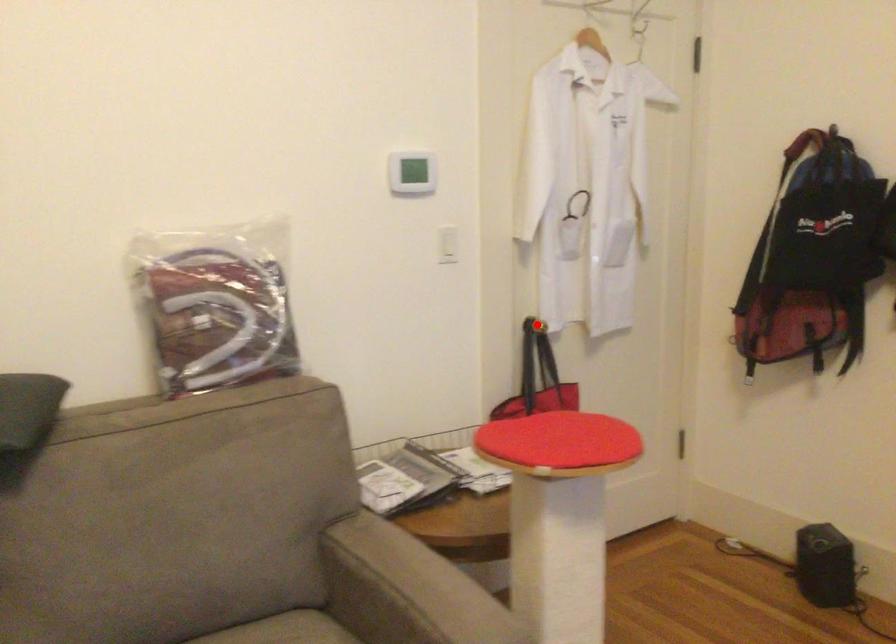
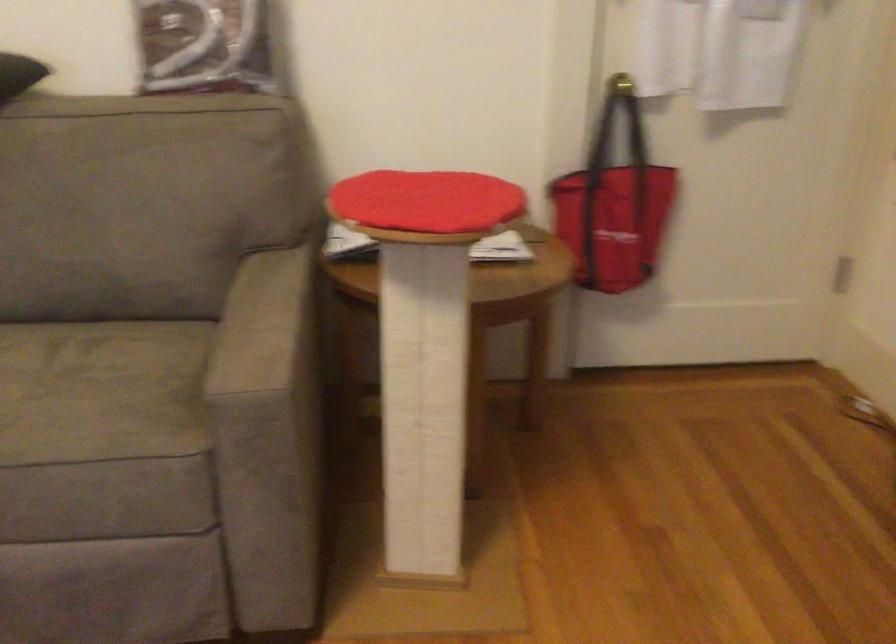
The point at the highlighted location is marked in the first image. Where is the corresponding point in the second image?

(619, 84)